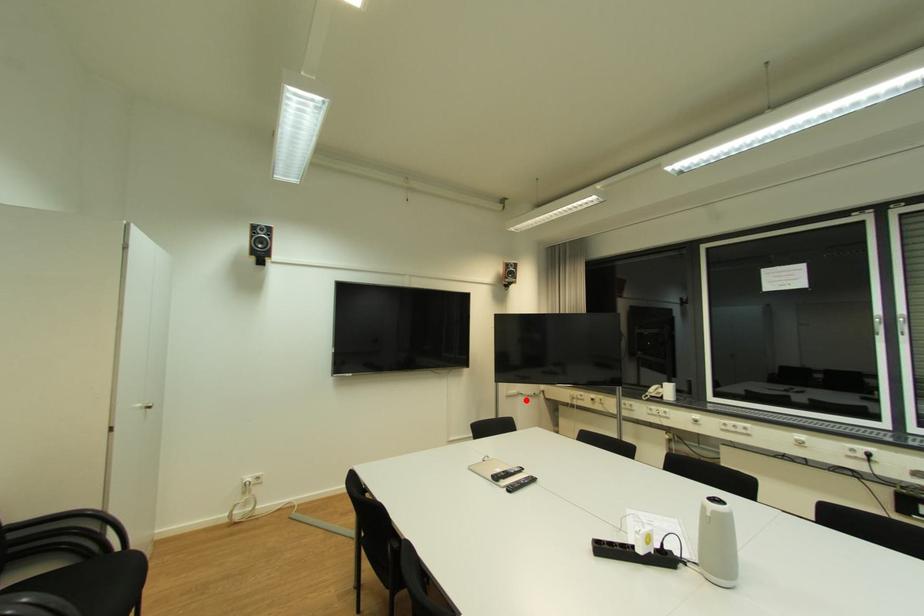
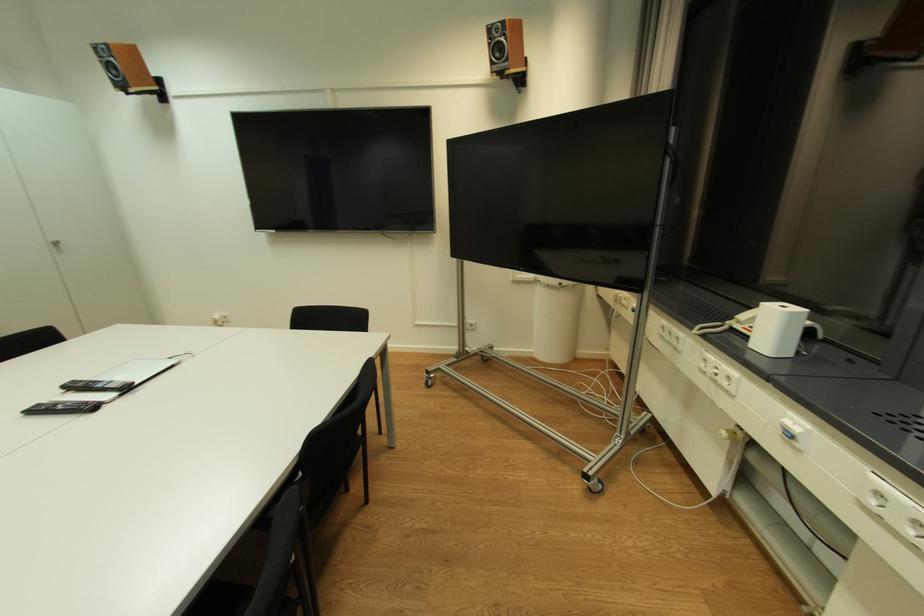
Question: I am providing you with two images of the same scene from different viewpoints. A red point is marked on the first image. Can you still see the location of the red point in image 2?

Choices:
 (A) Yes
 (B) No

Answer: (A)